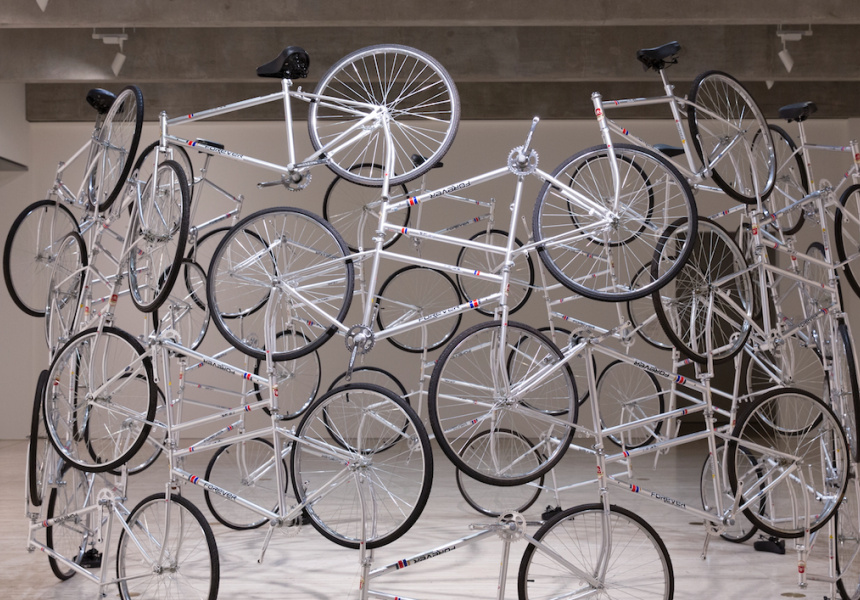
Locate an element on the screen. This screenshot has width=860, height=600. lightbulb housing is located at coordinates (118, 65), (788, 58).